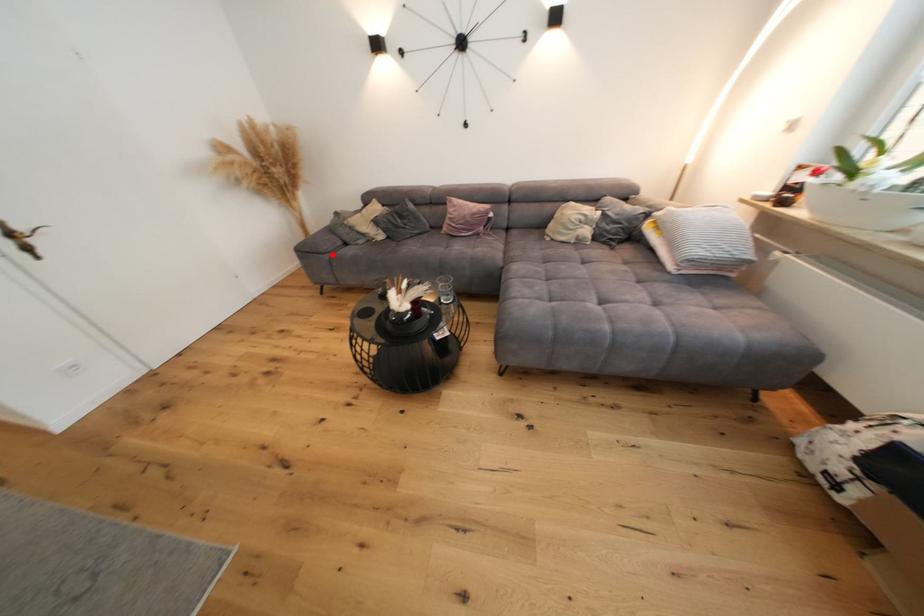
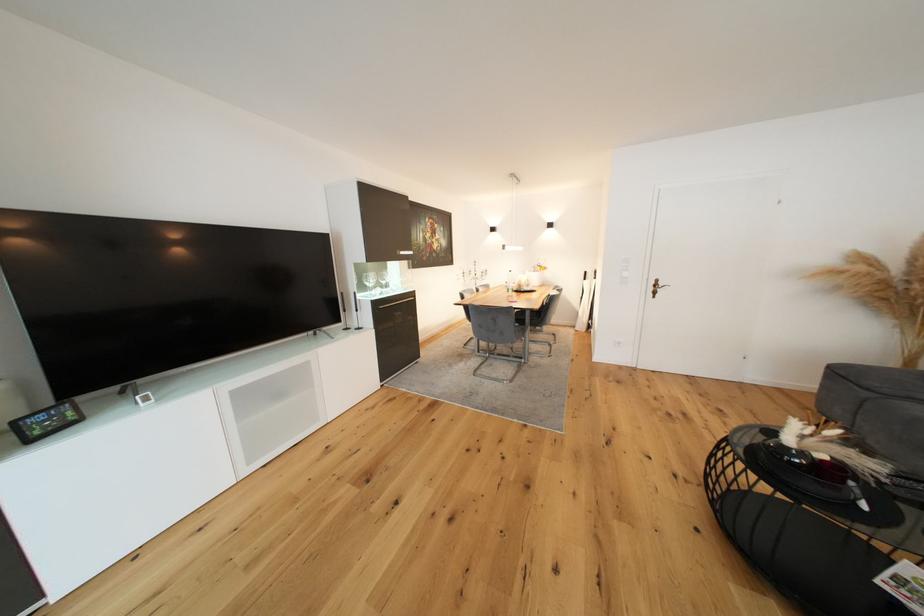
Locate, in the second image, the point that corresponds to the highlighted location in the first image.

(874, 391)